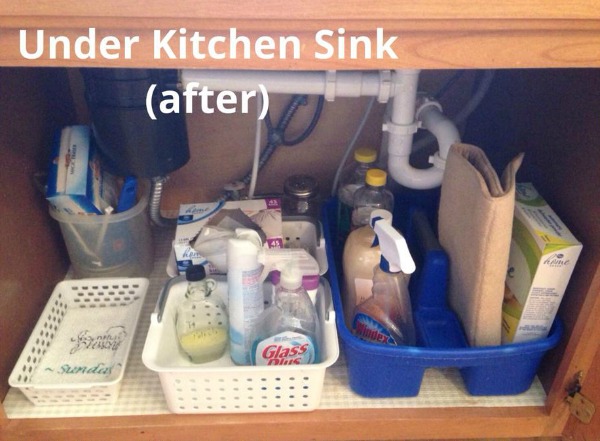
This screenshot has width=600, height=441. In order to click on soap in glass bottle in this screenshot , I will do `click(206, 342)`.